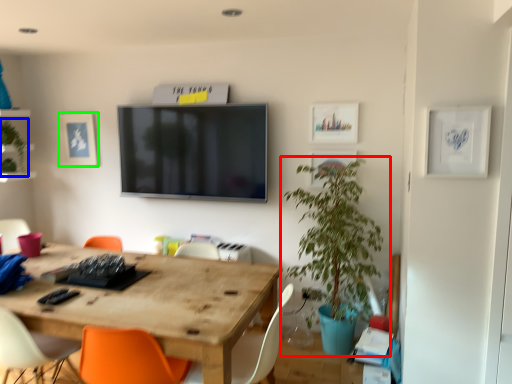
Question: Which object is positioned closest to houseplant (highlighted by a red box)? Select from plant (highlighted by a blue box) and picture frame (highlighted by a green box).

Choices:
 (A) plant
 (B) picture frame

Answer: (B)